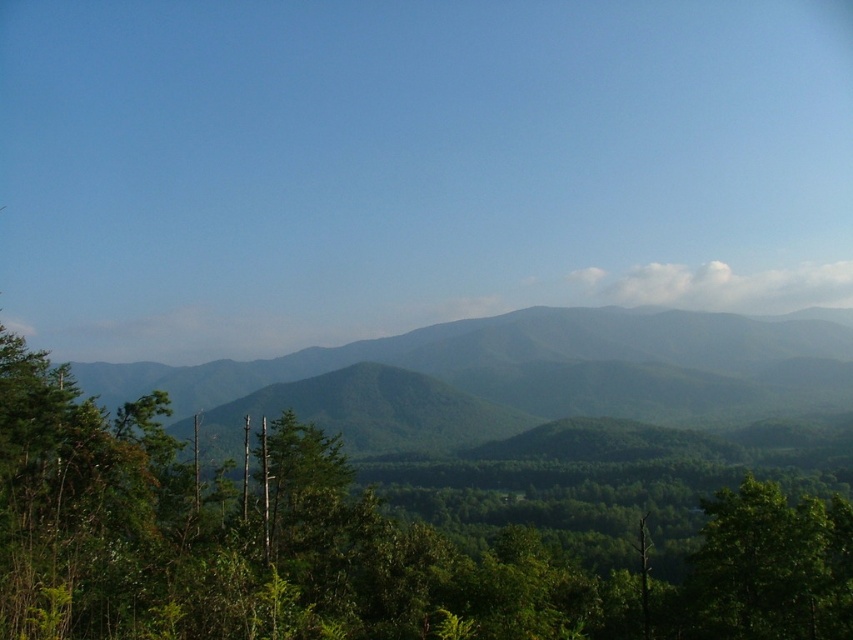
Between green leafy tree at center and green leafy tree at lower right, which one has more height?

Standing taller between the two is green leafy tree at center.

Locate an element on the screen. This screenshot has width=853, height=640. green leafy tree at center is located at coordinates (349, 545).

Image resolution: width=853 pixels, height=640 pixels. What do you see at coordinates (532, 372) in the screenshot?
I see `green matte mountain range at center` at bounding box center [532, 372].

Is green matte mountain range at center further to the viewer compared to green leafy tree at lower right?

Yes, green matte mountain range at center is further from the viewer.

Does point (167, 365) come behind point (851, 552)?

Yes, it is.

Identify the location of green matte mountain range at center. The height and width of the screenshot is (640, 853). (532, 372).

Can you confirm if green leafy tree at center is taller than green matte mountain range at center?

No.

Does green leafy tree at center appear over green matte mountain range at center?

Yes, green leafy tree at center is above green matte mountain range at center.

The image size is (853, 640). What do you see at coordinates (349, 545) in the screenshot? I see `green leafy tree at center` at bounding box center [349, 545].

The width and height of the screenshot is (853, 640). What are the coordinates of `green leafy tree at center` in the screenshot? It's located at [x=349, y=545].